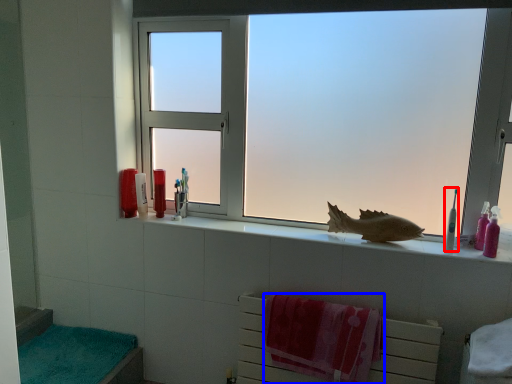
Question: Which object is closer to the camera taking this photo, toothbrush (highlighted by a red box) or beach towel (highlighted by a blue box)?

Choices:
 (A) toothbrush
 (B) beach towel

Answer: (B)